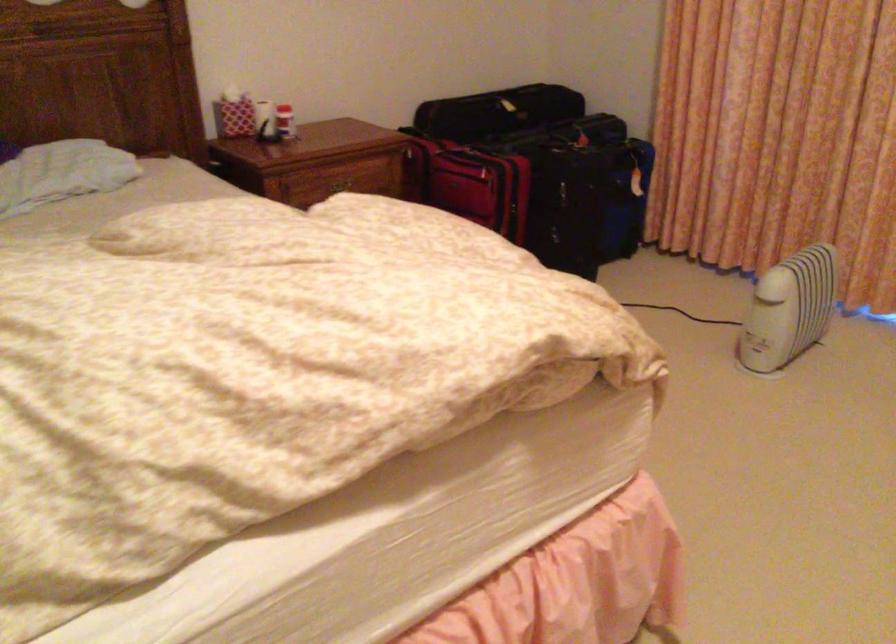
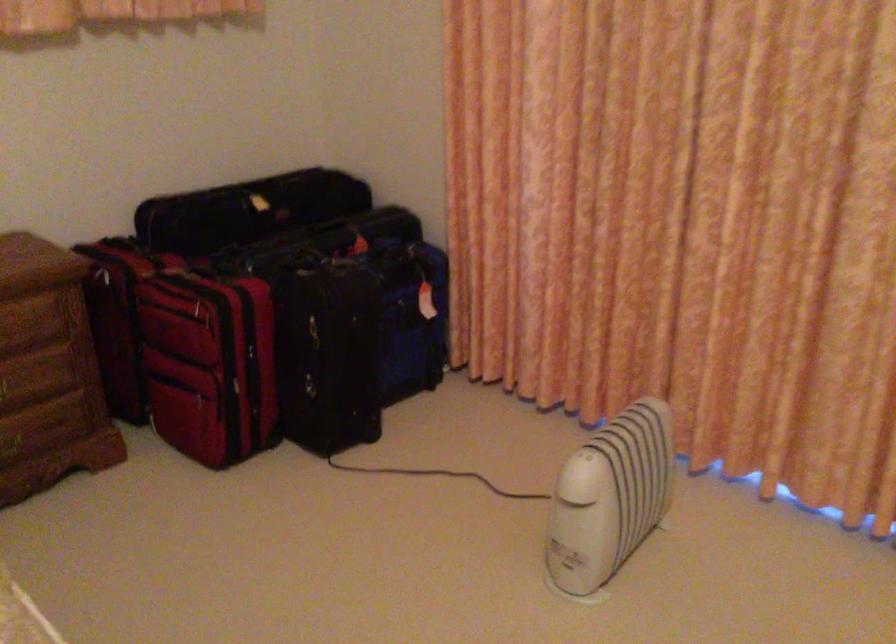
Question: I am providing you with two images of the same scene from different viewpoints. Please identify which objects are invisible in image2.

Choices:
 (A) red suitcase handle
 (B) black case handle
 (C) white space heater
 (D) none of these

Answer: (D)